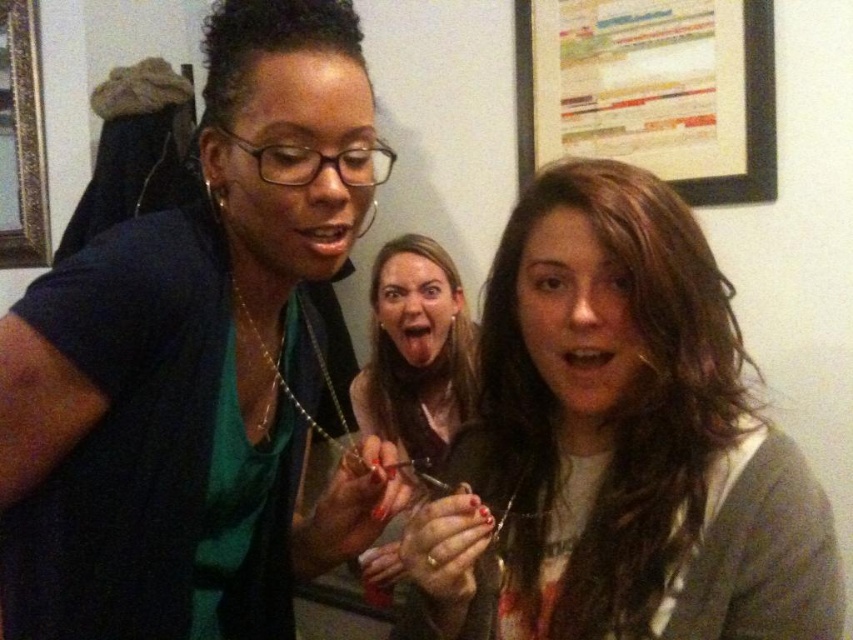
You are a photographer trying to capture a candid shot of the matte brown hair at center and the white paperboard at upper center. Based on their sizes, which one should you focus on to ensure it fills the frame better?

The matte brown hair at center is larger in width than the white paperboard at upper center, so focusing on the matte brown hair at center would fill the frame better.

You are standing at point (19, 76) and want to walk to point (398, 308). Is the path clear? Please explain based on the scene description.

The path between point (398, 308) and point (19, 76) is clear because point (398, 308) is in front of point (19, 76), indicating no obstruction between them.

You are standing at the origin point in the image. You need to locate the matte black shirt at center. Which direction should you move to face it?

Since the 2D location of the matte black shirt at center is at point 0.572 on the x axis and 0.232 on the y axis, you should move to the right and slightly downward to face it.